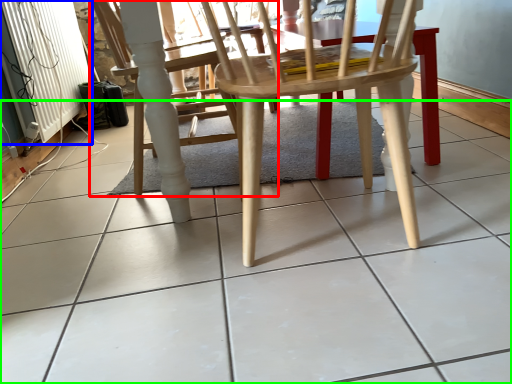
Question: Which object is the closest to the chair (highlighted by a red box)? Choose among these: radiator (highlighted by a blue box) or ceramic tile (highlighted by a green box).

Choices:
 (A) radiator
 (B) ceramic tile

Answer: (B)